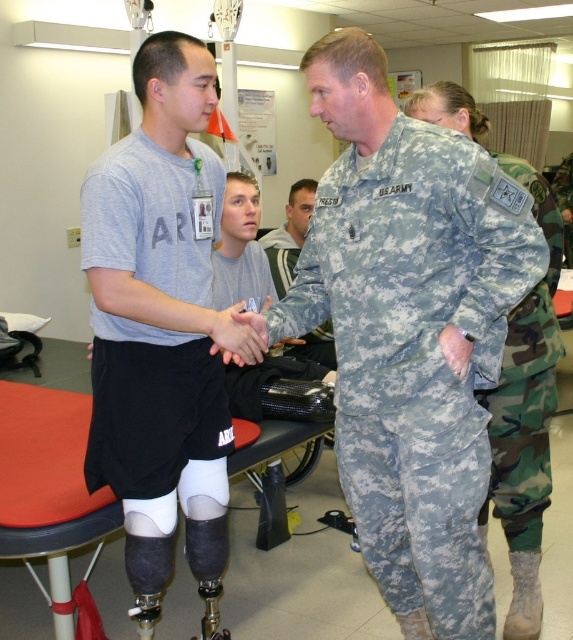
Between camouflage fabric uniform at center and camouflage uniform at center, which one has less height?

With less height is camouflage uniform at center.

Looking at this image, is camouflage fabric uniform at center closer to camera compared to camouflage uniform at center?

Yes, camouflage fabric uniform at center is in front of camouflage uniform at center.

Image resolution: width=573 pixels, height=640 pixels. Identify the location of camouflage fabric uniform at center. (417, 353).

Identify the location of camouflage fabric uniform at center. coord(417,353).

Locate an element on the screen. The height and width of the screenshot is (640, 573). camouflage fabric uniform at center is located at coordinates (417, 353).

Who is more distant from viewer, (513, 321) or (297, 180)?

The point (297, 180) is behind.

Who is positioned more to the left, camouflage fabric pants at center or camouflage uniform at center?

Positioned to the left is camouflage uniform at center.

Is point (535, 180) more distant than point (261, 244)?

No, (535, 180) is in front of (261, 244).

The image size is (573, 640). Find the location of `camouflage fabric pants at center`. camouflage fabric pants at center is located at coordinates (525, 385).